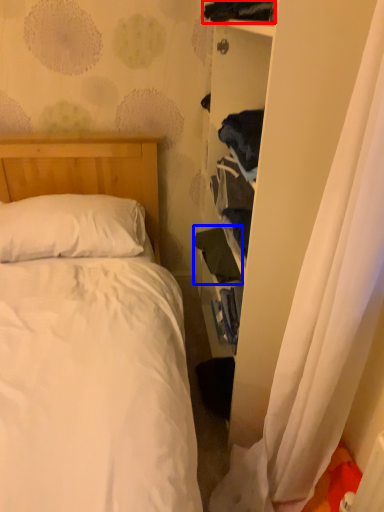
Question: Which point is further to the camera, clothing (highlighted by a red box) or clothing (highlighted by a blue box)?

Choices:
 (A) clothing
 (B) clothing

Answer: (B)